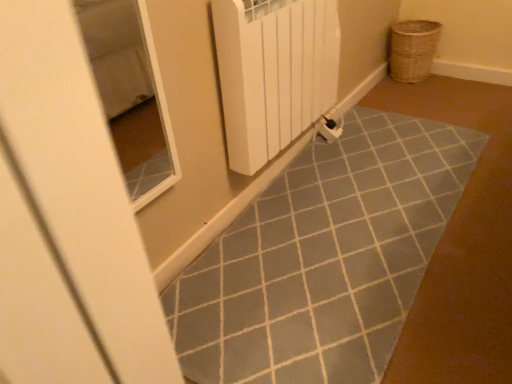
Question: Is white plastic radiator at center closer to camera compared to woven brown basket at upper right?

Choices:
 (A) no
 (B) yes

Answer: (B)

Question: Does white plastic radiator at center have a lesser height compared to woven brown basket at upper right?

Choices:
 (A) yes
 (B) no

Answer: (B)

Question: Can we say white plastic radiator at center lies outside woven brown basket at upper right?

Choices:
 (A) yes
 (B) no

Answer: (A)

Question: Is white plastic radiator at center next to woven brown basket at upper right?

Choices:
 (A) yes
 (B) no

Answer: (B)

Question: Does white plastic radiator at center have a greater width compared to woven brown basket at upper right?

Choices:
 (A) no
 (B) yes

Answer: (A)

Question: Can you confirm if white plastic radiator at center is positioned to the left of woven brown basket at upper right?

Choices:
 (A) no
 (B) yes

Answer: (B)

Question: From the image's perspective, does woven brown basket at upper right appear lower than white plastic radiator at center?

Choices:
 (A) yes
 (B) no

Answer: (B)

Question: Is woven brown basket at upper right further to camera compared to white plastic radiator at center?

Choices:
 (A) no
 (B) yes

Answer: (B)

Question: From a real-world perspective, is woven brown basket at upper right located beneath white plastic radiator at center?

Choices:
 (A) yes
 (B) no

Answer: (A)

Question: Is woven brown basket at upper right at the right side of white plastic radiator at center?

Choices:
 (A) no
 (B) yes

Answer: (B)

Question: From the image's perspective, is woven brown basket at upper right on white plastic radiator at center?

Choices:
 (A) yes
 (B) no

Answer: (A)

Question: Considering the relative sizes of woven brown basket at upper right and white plastic radiator at center in the image provided, is woven brown basket at upper right shorter than white plastic radiator at center?

Choices:
 (A) no
 (B) yes

Answer: (B)

Question: From a real-world perspective, is white plastic radiator at center above or below woven brown basket at upper right?

Choices:
 (A) below
 (B) above

Answer: (B)